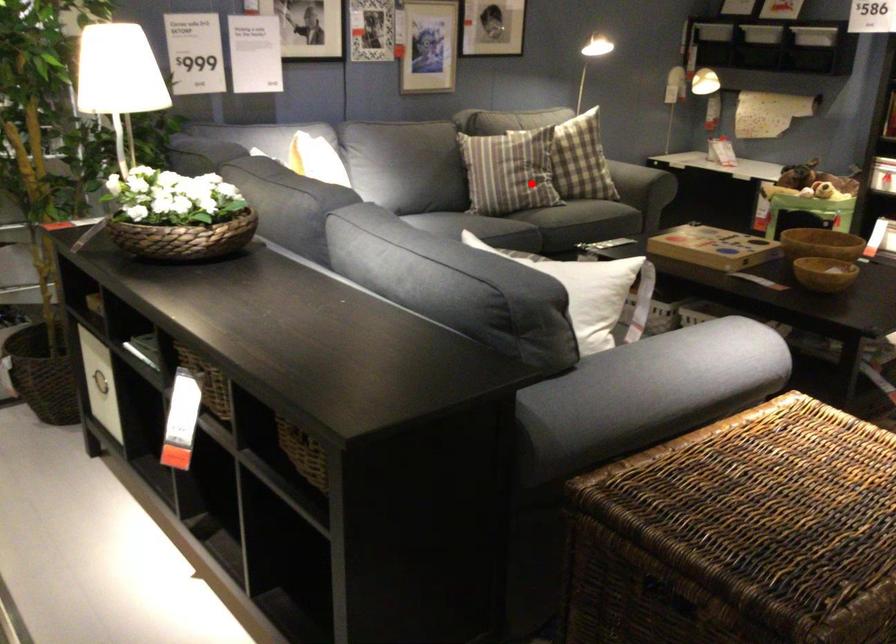
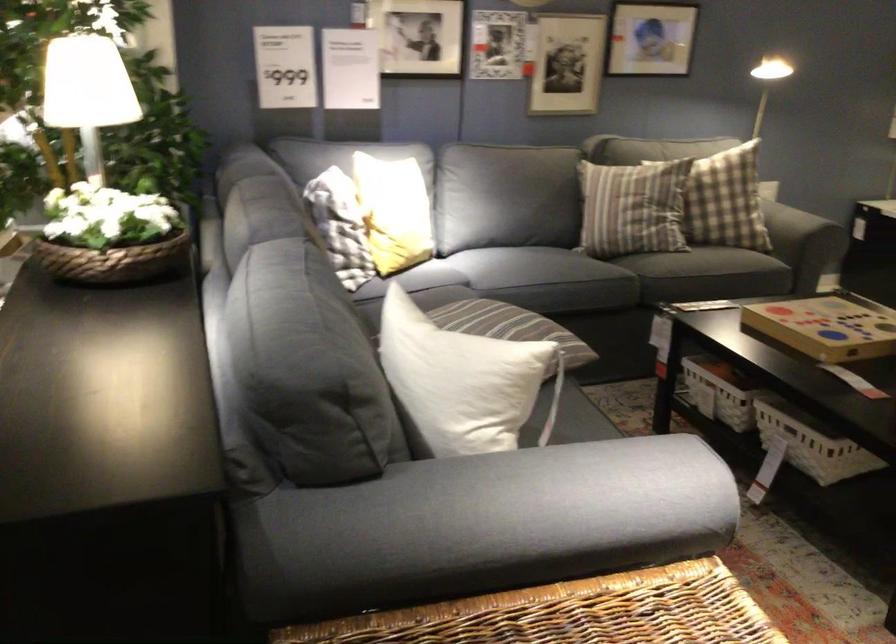
Question: I am providing you with two images of the same scene from different viewpoints. A red point is shown in image1. For the corresponding object point in image2, is it positioned nearer or farther from the camera?

Choices:
 (A) Nearer
 (B) Farther

Answer: (A)